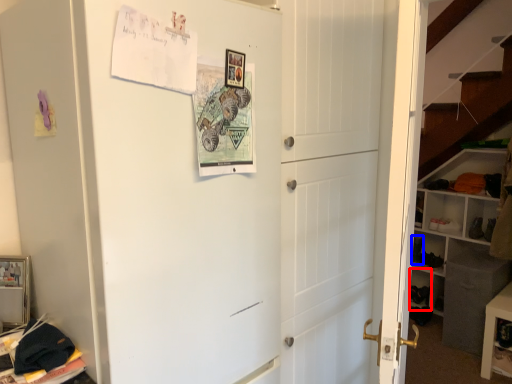
Question: Which object is further to the camera taking this photo, cabinet (highlighted by a red box) or shoe (highlighted by a blue box)?

Choices:
 (A) cabinet
 (B) shoe

Answer: (B)